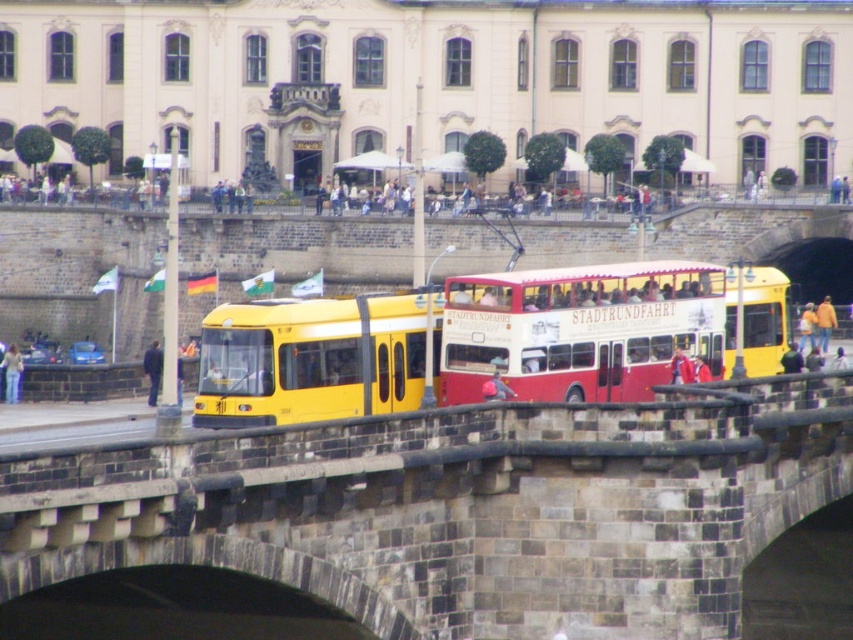
You are a tourist standing on the stone bridge at center and looking towards the black fabric jacket at left. Which object is closer to you?

The stone bridge at center is closer to you because it is in front of the black fabric jacket at left.

You are a tourist standing on the bridge and want to take a photo of both the yellow matte tram at center and the yellow plastic bus at center. Which vehicle should you focus on first to ensure both are in the frame?

You should focus on the yellow matte tram at center first because it is closer to you than the yellow plastic bus at center, ensuring both are in the frame.

You are standing on the stone bridge looking at the yellow tram and red double decker bus. There are two points marked on the bridge. One is at coordinate point (653, 573) and the other is at point (160, 385). Which point is closer to you?

Point (653, 573) is closer to the camera than point (160, 385).